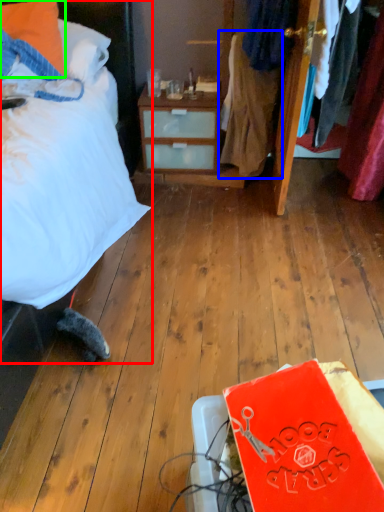
Question: Considering the real-world distances, which object is farthest from bed (highlighted by a red box)? clothing (highlighted by a blue box) or pillow (highlighted by a green box)?

Choices:
 (A) clothing
 (B) pillow

Answer: (A)